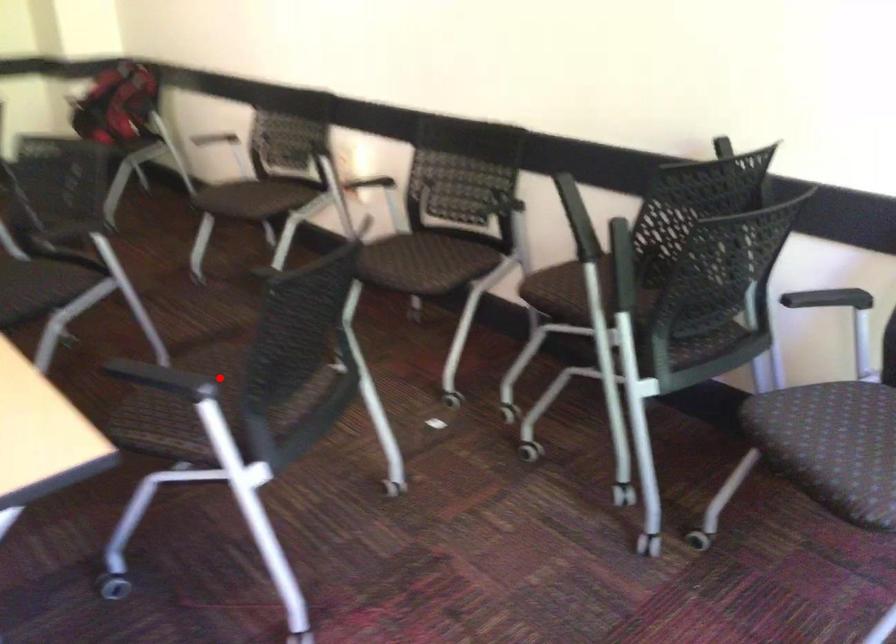
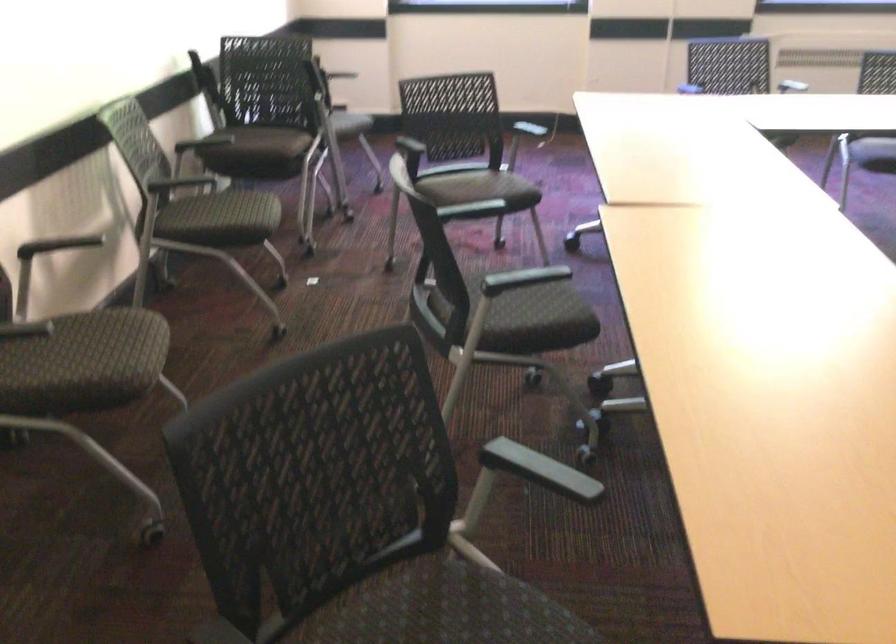
Where in the second image is the point corresponding to the highlighted location from the first image?

(479, 189)